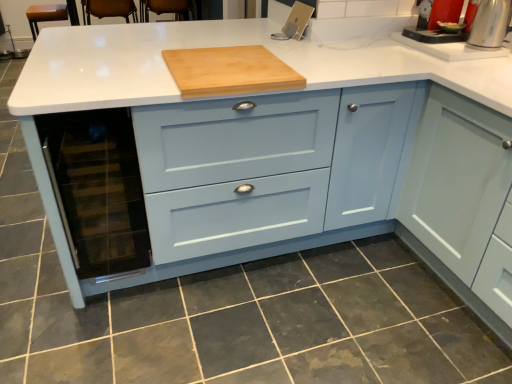
Image resolution: width=512 pixels, height=384 pixels. What are the coordinates of `free spot to the right of transparent glass wine cooler at lower left` in the screenshot? It's located at (177, 298).